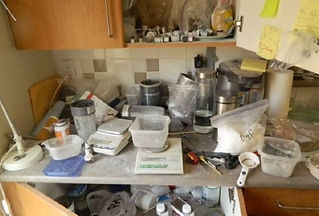
Identify the location of outlet. The width and height of the screenshot is (319, 216). [x=68, y=68].